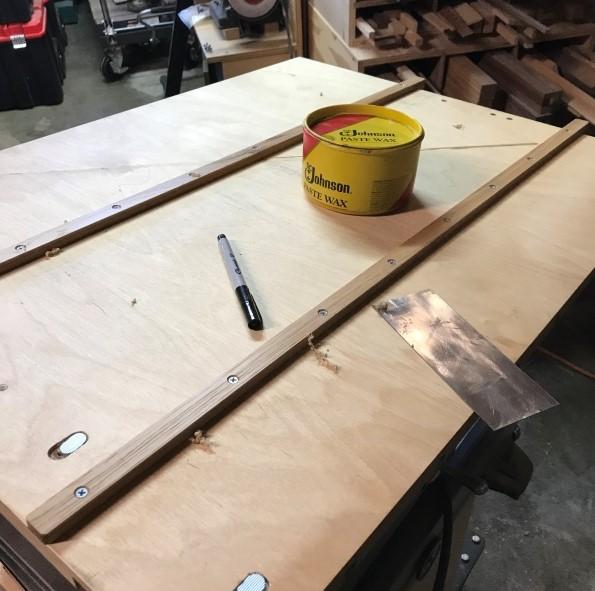
This screenshot has height=591, width=595. I want to click on marker, so point(238,278).